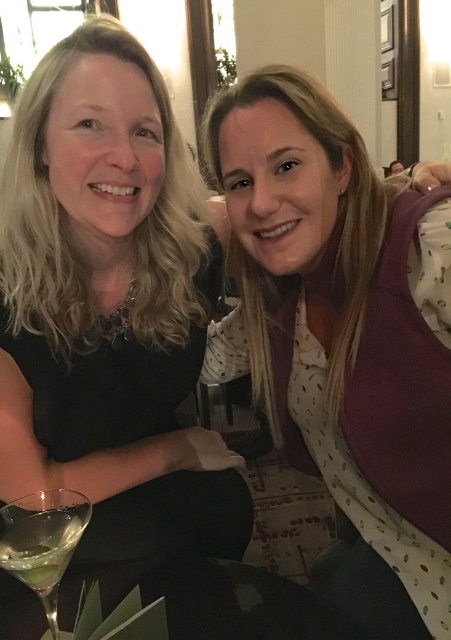
You are a photographer taking a portrait of the two people in the scene. You want to ensure that both the matte black dress at center and the white dotted shirt at center are clearly visible in the photo. Based on their positions, which clothing item is positioned higher in the frame?

The matte black dress at center is located above the white dotted shirt at center, so it is positioned higher in the frame.

You are planning to wear both the matte black dress at center and the white dotted shirt at center for an event. Based on the image, which one should you choose if you want to cover more of your body?

The matte black dress at center is bigger than the white dotted shirt at center, so you should choose the matte black dress at center to cover more of your body.